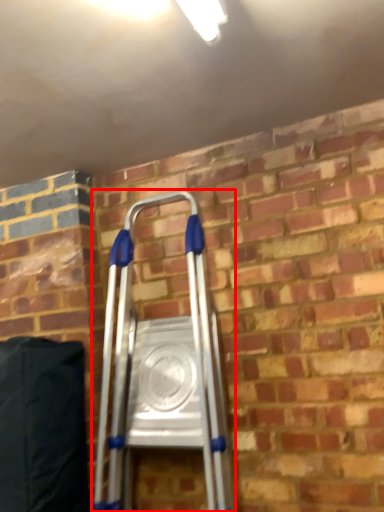
Question: Observing the image, what is the correct spatial positioning of ladder (annotated by the red box) in reference to bean bag chair?

Choices:
 (A) left
 (B) right

Answer: (B)